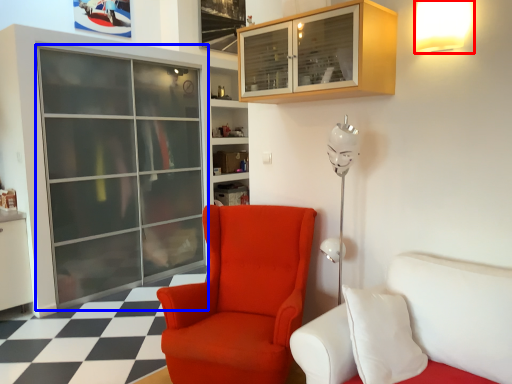
Question: Which point is further to the camera, light fixture (highlighted by a red box) or screen door (highlighted by a blue box)?

Choices:
 (A) light fixture
 (B) screen door

Answer: (B)